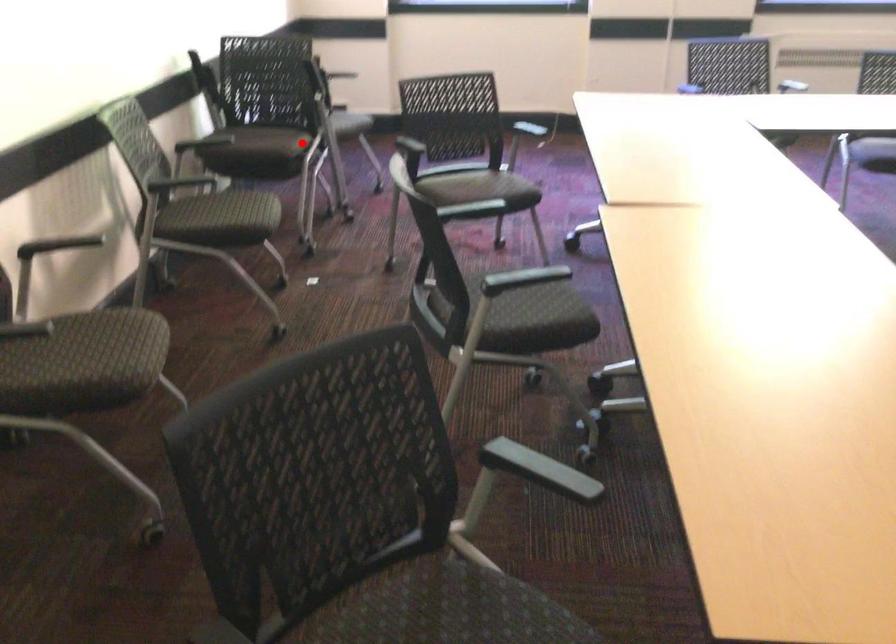
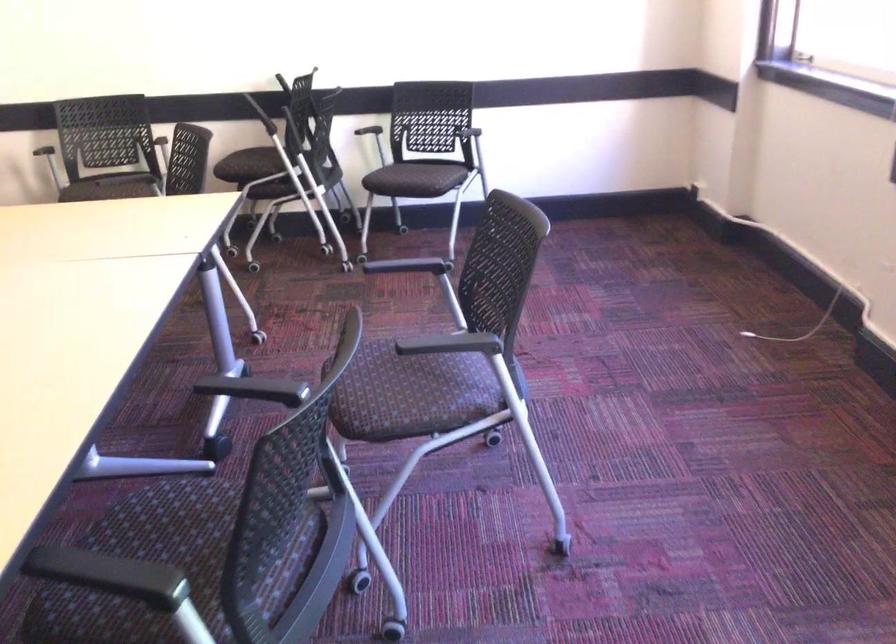
Where in the second image is the point corresponding to the highlighted location from the first image?

(252, 166)